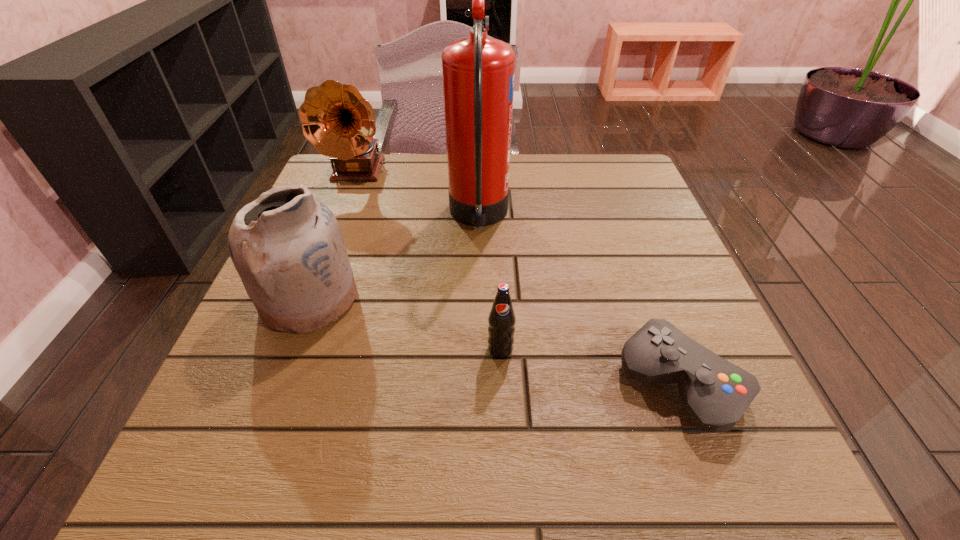
You are a GUI agent. You are given a task and a screenshot of the screen. Output one action in this format:
    pyautogui.click(x=<x>, y=<y>)
    Task: Click on the free space between the shortest object and the fire extinguisher
    
    Given the screenshot: What is the action you would take?
    pyautogui.click(x=580, y=300)

Where is `vacant point located between the fourth tallest object and the shortest object`? The width and height of the screenshot is (960, 540). vacant point located between the fourth tallest object and the shortest object is located at coordinates (590, 366).

This screenshot has width=960, height=540. What are the coordinates of `vacant area that lies between the fire extinguisher and the pop` in the screenshot? It's located at (490, 283).

Find the location of a particular element. free space between the fire extinguisher and the pottery is located at coordinates (394, 258).

Image resolution: width=960 pixels, height=540 pixels. In order to click on vacant point located between the pop and the tallest object in this screenshot , I will do `click(490, 283)`.

Identify the location of vacant space that is in between the control and the second shortest object. (590, 366).

Identify which object is the closest to the pop. Please provide its 2D coordinates. Your answer should be formatted as a tuple, i.e. [(x, y)], where the tuple contains the x and y coordinates of a point satisfying the conditions above.

[(715, 393)]

Select which object is the closest to the phonograph_record. Please provide its 2D coordinates. Your answer should be formatted as a tuple, i.e. [(x, y)], where the tuple contains the x and y coordinates of a point satisfying the conditions above.

[(478, 71)]

Locate an element on the screen. This screenshot has height=540, width=960. free space that satisfies the following two spatial constraints: 1. on the front label of the second shortest object; 2. on the right side of the control is located at coordinates (502, 383).

This screenshot has width=960, height=540. Identify the location of free space in the image that satisfies the following two spatial constraints: 1. on the front label of the pop; 2. on the left side of the shortest object. (502, 383).